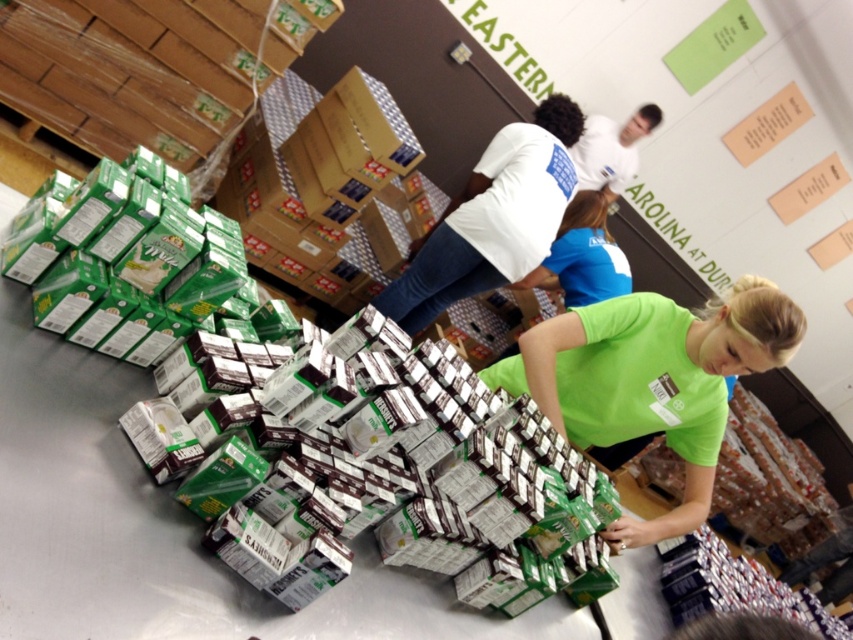
You are an organizer at the warehouse and need to determine which shirt to use for a promotional photo. The requirement is that the shirt must be the shorter one between the green matte shirt at center and the white cotton shirt at center. Which shirt should you choose?

The green matte shirt at center is shorter than the white cotton shirt at center, so you should choose the green matte shirt at center for the promotional photo.

You are organizing a charity event and need to decide which shirt to use for volunteers. The green matte shirt at center and the white cotton shirt at center are available. Which shirt has a smaller size?

The green matte shirt at center is smaller than the white cotton shirt at center, so the green matte shirt at center has a smaller size.